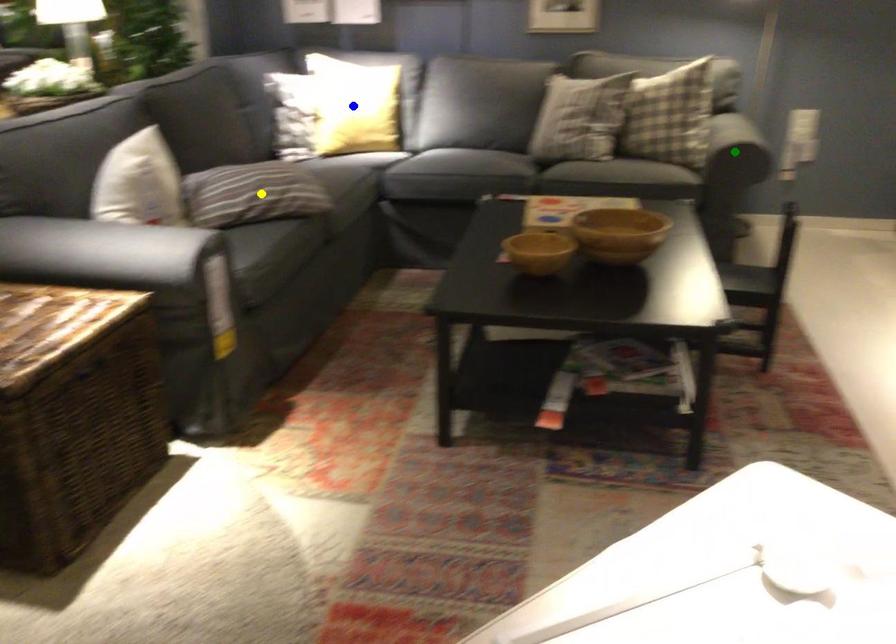
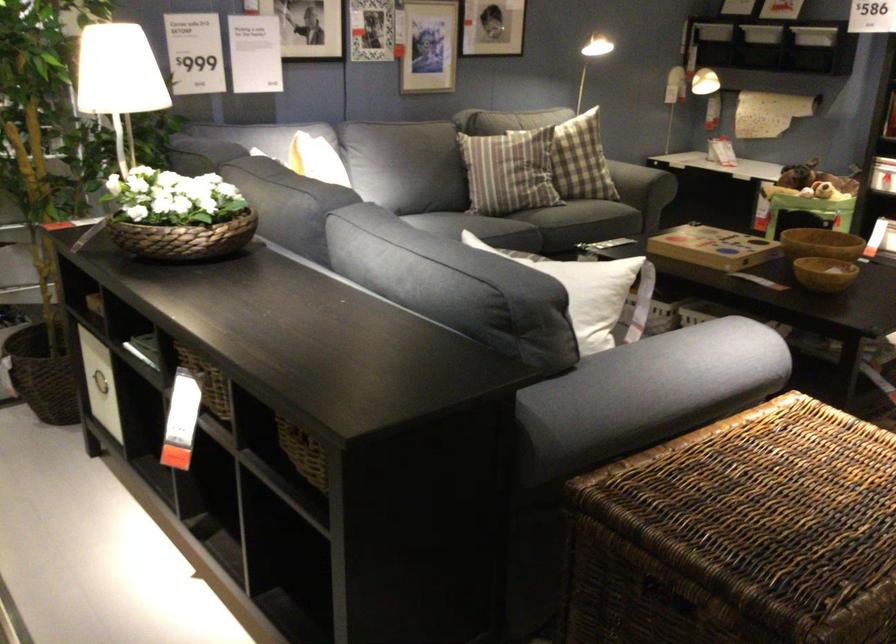
I am providing you with two images of the same scene from different viewpoints. Three points are marked in image1. Which point corresponds to a part or object that is occluded in image2?In image1, three points are marked. Which of them correspond to a part or object that is occluded in image2?Among the three points shown in image1, which one corresponds to a part or object that is no longer visible due to occlusion in image2?

blue point, green point, yellow point cannot be seen in image2.